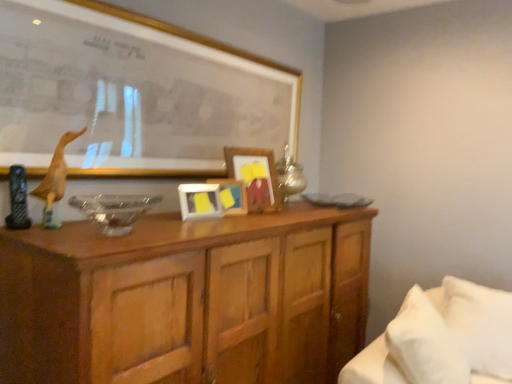
Question: From a real-world perspective, is matte gold picture frame at upper center, positioned as the 4th picture frame in back-to-front order, on top of white soft bed at lower right?

Choices:
 (A) yes
 (B) no

Answer: (A)

Question: From a real-world perspective, is matte gold picture frame at upper center, positioned as the 4th picture frame in back-to-front order, beneath white soft bed at lower right?

Choices:
 (A) no
 (B) yes

Answer: (A)

Question: Is matte gold picture frame at upper center, positioned as the 4th picture frame in back-to-front order, thinner than white soft bed at lower right?

Choices:
 (A) no
 (B) yes

Answer: (B)

Question: Is matte gold picture frame at upper center, which appears as the first picture frame when viewed from the front, placed right next to white soft bed at lower right?

Choices:
 (A) no
 (B) yes

Answer: (A)

Question: Is the position of matte gold picture frame at upper center, which appears as the first picture frame when viewed from the front, more distant than that of white soft bed at lower right?

Choices:
 (A) no
 (B) yes

Answer: (B)

Question: Looking at the image, does white soft bed at lower right seem bigger or smaller compared to wooden cabinet at center?

Choices:
 (A) big
 (B) small

Answer: (B)

Question: In terms of width, does white soft bed at lower right look wider or thinner when compared to wooden cabinet at center?

Choices:
 (A) thin
 (B) wide

Answer: (A)

Question: Is white soft bed at lower right inside the boundaries of wooden cabinet at center, or outside?

Choices:
 (A) inside
 (B) outside

Answer: (B)

Question: From the image's perspective, relative to wooden cabinet at center, is white soft bed at lower right above or below?

Choices:
 (A) above
 (B) below

Answer: (A)

Question: Is yellow matte picture frame at center, which is the second picture frame in back-to-front order, to the left or to the right of wooden cabinet at center in the image?

Choices:
 (A) left
 (B) right

Answer: (A)

Question: From a real-world perspective, is yellow matte picture frame at center, which is the second picture frame in back-to-front order, physically located above or below wooden cabinet at center?

Choices:
 (A) below
 (B) above

Answer: (B)

Question: Considering the positions of yellow matte picture frame at center, which is the second picture frame in back-to-front order, and wooden cabinet at center in the image, is yellow matte picture frame at center, which is the second picture frame in back-to-front order, taller or shorter than wooden cabinet at center?

Choices:
 (A) short
 (B) tall

Answer: (A)

Question: Looking at the image, does yellow matte picture frame at center, acting as the 3th picture frame starting from the front, seem bigger or smaller compared to wooden cabinet at center?

Choices:
 (A) small
 (B) big

Answer: (A)

Question: Is point (485, 304) closer or farther from the camera than point (193, 203)?

Choices:
 (A) closer
 (B) farther

Answer: (B)

Question: Is white soft pillow at lower right in front of or behind matte yellow picture frame at center, the second picture frame in the front-to-back sequence, in the image?

Choices:
 (A) front
 (B) behind

Answer: (A)